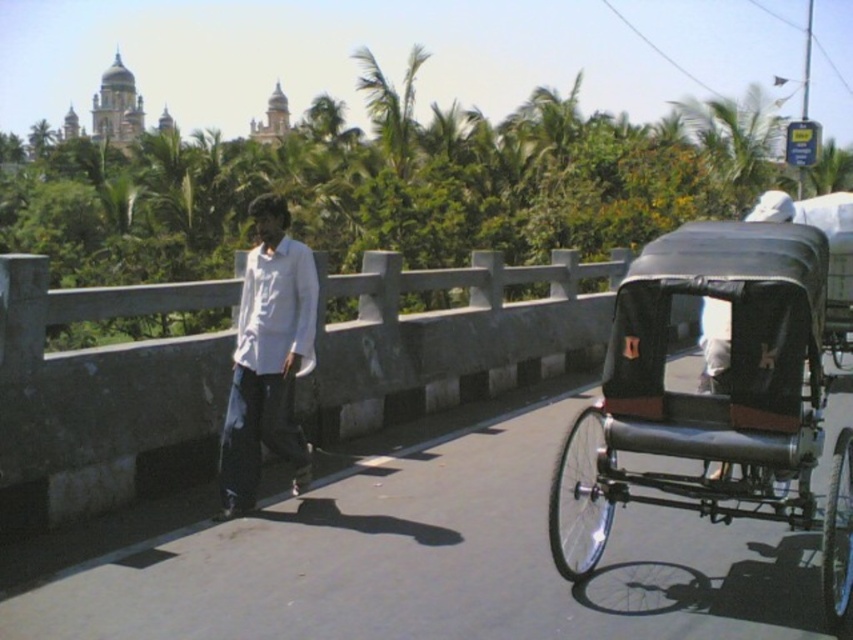
You are standing on the bridge and want to take a photo of the black leather rickshaw at right. The camera you have can focus on objects up to 30 meters away. Will the rickshaw be in focus?

The black leather rickshaw at right is 29.41 meters from viewer, so yes, the camera can focus on it since it is within the 30 meter range.

You are a photographer standing at the center of the bridge. You want to take a photo that includes both the black leather rickshaw at right and the white matte shirt at center. Based on their positions, which object should you pan your camera towards first to ensure both are in frame?

Since the black leather rickshaw at right is to the right of the white matte shirt at center, you should pan your camera towards the white matte shirt at center first to ensure both are in frame.

You are standing at the center of the bridge and want to take a photo of the black leather rickshaw at right. Which direction should you turn to face it?

You should turn to your right to face the black leather rickshaw at right since it is located to the right side of the scene.